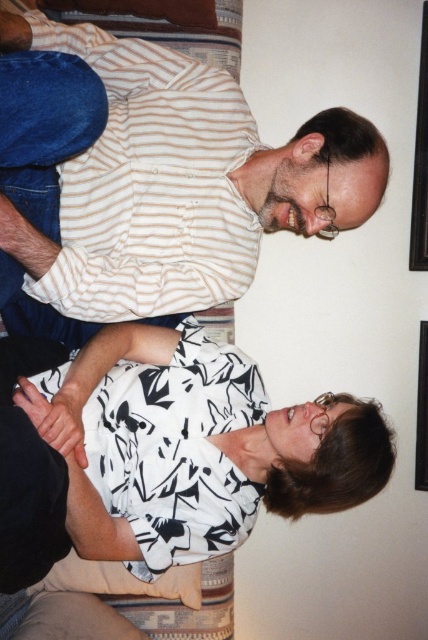
Question: Is the position of velvet blue bed at upper left less distant than that of black plastic picture frame at upper right?

Choices:
 (A) no
 (B) yes

Answer: (B)

Question: Which is farther from the white striped shirt at upper center?

Choices:
 (A) black plastic picture frame at upper right
 (B) velvet blue bed at upper left
 (C) white printed blouse at lower center
 (D) black wood picture frame at upper right

Answer: (A)

Question: Which point is farther to the camera?

Choices:
 (A) (418, 381)
 (B) (122, 353)
 (C) (154, 604)
 (D) (424, 182)

Answer: (A)

Question: Which object appears closest to the camera in this image?

Choices:
 (A) velvet blue bed at upper left
 (B) black plastic picture frame at upper right

Answer: (A)

Question: Does white printed blouse at lower center appear over velvet blue bed at upper left?

Choices:
 (A) no
 (B) yes

Answer: (A)

Question: Does white striped shirt at upper center appear under black wood picture frame at upper right?

Choices:
 (A) yes
 (B) no

Answer: (A)